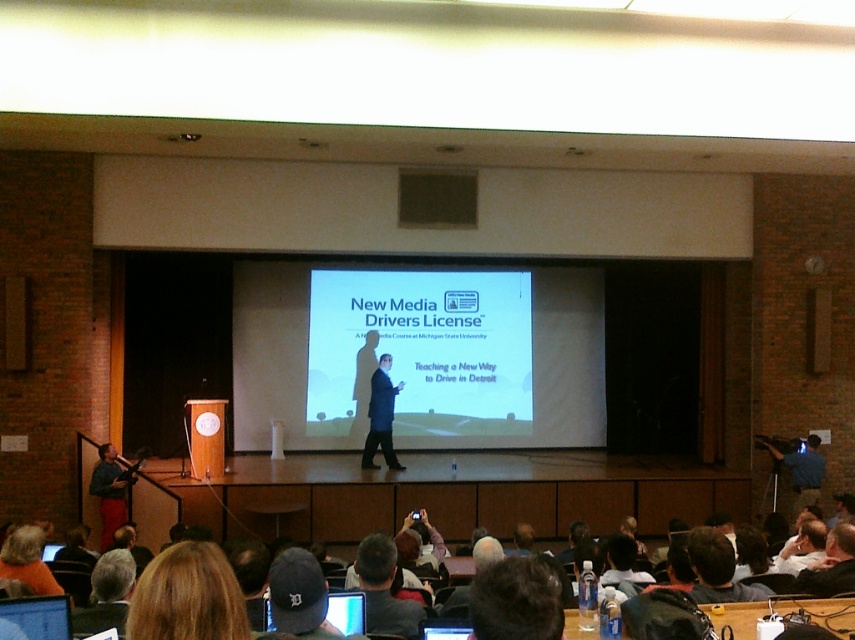
Question: Which of these objects is positioned farthest from the blue fabric camera at lower right?

Choices:
 (A) gray fabric shirt at lower center
 (B) white matte projection screen at center
 (C) blonde hair at lower center
 (D) dark gray suit at center

Answer: (C)

Question: Is gray fabric shirt at lower center further to camera compared to blue fabric camera at lower right?

Choices:
 (A) no
 (B) yes

Answer: (A)

Question: Can you confirm if white matte projection screen at center is smaller than blonde hair at lower center?

Choices:
 (A) no
 (B) yes

Answer: (A)

Question: Among these objects, which one is farthest from the camera?

Choices:
 (A) blonde hair at lower center
 (B) blue fabric camera at lower right
 (C) dark gray suit at center

Answer: (C)

Question: Can you confirm if gray fabric shirt at lower center is thinner than dark gray suit at center?

Choices:
 (A) no
 (B) yes

Answer: (B)

Question: Which object appears closest to the camera in this image?

Choices:
 (A) gray fabric shirt at lower center
 (B) blue fabric camera at lower right
 (C) white matte projection screen at center
 (D) dark gray suit at center

Answer: (A)